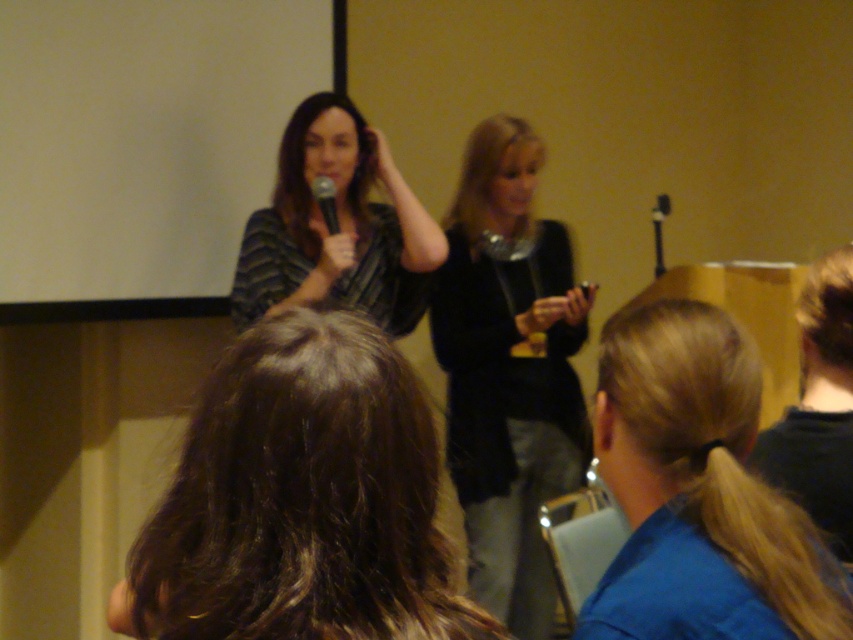
You are an event organizer checking the stage setup. You need to ensure that the black fuzzy sweater at center and the black matte microphone at upper center are placed appropriately. Which object is wider?

The black fuzzy sweater at center is wider than the black matte microphone at upper center.